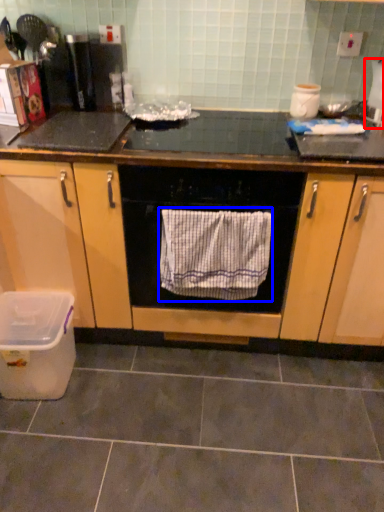
Question: Which of the following is the closest to the observer, appliance (highlighted by a red box) or bath towel (highlighted by a blue box)?

Choices:
 (A) appliance
 (B) bath towel

Answer: (B)